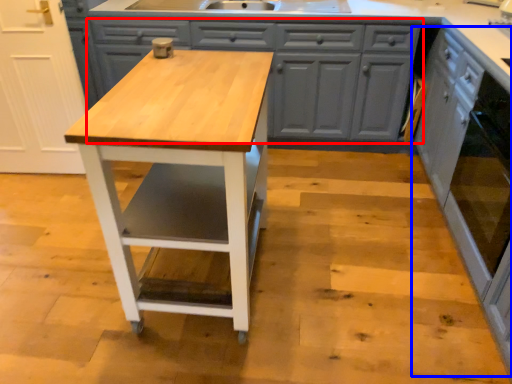
Question: Which object appears farthest to the camera in this image, cabinetry (highlighted by a red box) or cabinetry (highlighted by a blue box)?

Choices:
 (A) cabinetry
 (B) cabinetry

Answer: (A)